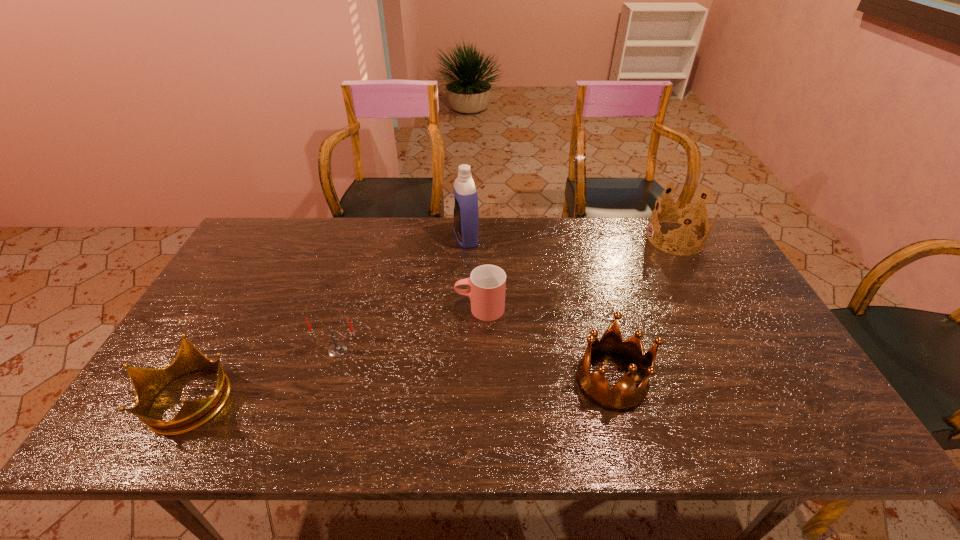
Locate an element on the screen. This screenshot has width=960, height=540. detergent is located at coordinates point(466,217).

The width and height of the screenshot is (960, 540). I want to click on the rightmost crown, so click(684, 213).

The image size is (960, 540). I want to click on the rightmost object, so click(684, 213).

I want to click on the second crown from right to left, so click(x=624, y=396).

Locate an element on the screen. cup is located at coordinates (487, 283).

Locate an element on the screen. The width and height of the screenshot is (960, 540). candle is located at coordinates (336, 350).

In order to click on the leftmost crown in this screenshot , I will do `click(147, 383)`.

Where is `the shortest crown`? The width and height of the screenshot is (960, 540). the shortest crown is located at coordinates pos(147,383).

Where is `free region located on the front of the detergent`? The image size is (960, 540). free region located on the front of the detergent is located at coordinates (463, 323).

The width and height of the screenshot is (960, 540). Find the location of `vacant space situated 0.400m on the front of the rightmost crown`. vacant space situated 0.400m on the front of the rightmost crown is located at coordinates (738, 354).